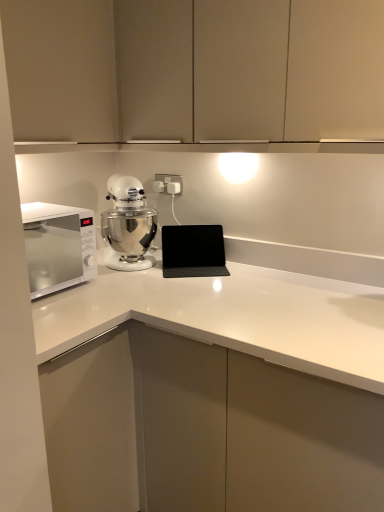
Question: From a real-world perspective, is black matte laptop at center above or below matte beige cabinet at upper left, acting as the 2th cabinetry starting from the right?

Choices:
 (A) above
 (B) below

Answer: (B)

Question: Is black matte laptop at center to the left or to the right of matte beige cabinet at upper left, which is counted as the first cabinetry, starting from the left, in the image?

Choices:
 (A) left
 (B) right

Answer: (B)

Question: Which is nearer to the white glossy microwave at left?

Choices:
 (A) matte beige cabinet at upper left, acting as the 2th cabinetry starting from the right
 (B) silver metallic mixer at center
 (C) black matte laptop at center
 (D) matte beige cabinets at upper center, arranged as the second cabinetry when viewed from the left
 (E) white plastic electric outlet at center

Answer: (B)

Question: Which object is the farthest from the black matte laptop at center?

Choices:
 (A) white plastic electric outlet at center
 (B) white glossy countertop at center
 (C) matte beige cabinet at upper left, acting as the 2th cabinetry starting from the right
 (D) matte beige cabinets at upper center, arranged as the second cabinetry when viewed from the left
 (E) silver metallic mixer at center

Answer: (C)